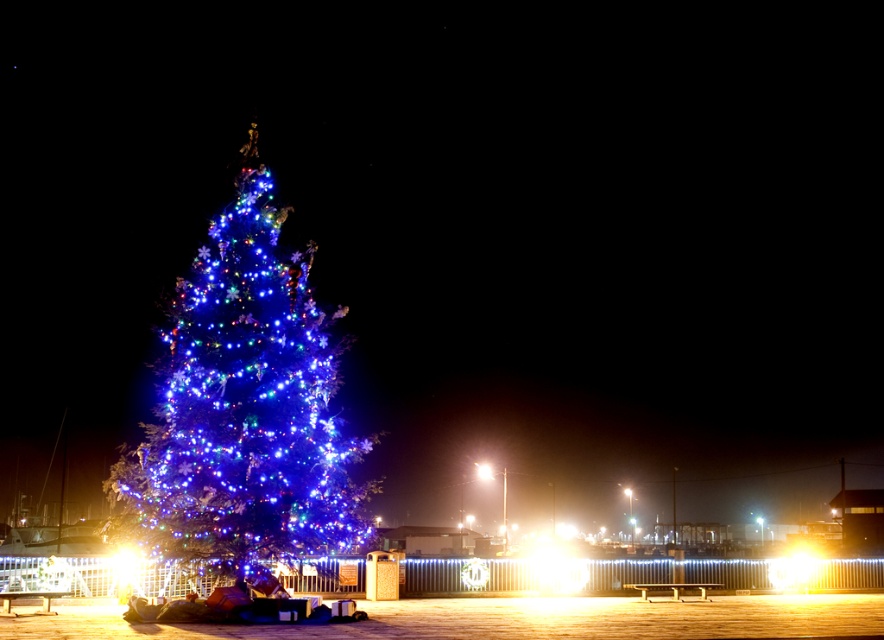
Question: Which point is farther to the camera?

Choices:
 (A) bright white light at center
 (B) illuminated blue lights at center

Answer: (A)

Question: Can you confirm if illuminated blue lights at center is positioned above bright white light at center?

Choices:
 (A) no
 (B) yes

Answer: (B)

Question: Which point is closer to the camera?

Choices:
 (A) (311, 349)
 (B) (492, 472)

Answer: (A)

Question: Is illuminated blue lights at center to the right of bright white light at center from the viewer's perspective?

Choices:
 (A) yes
 (B) no

Answer: (B)

Question: Which point is closer to the camera?

Choices:
 (A) bright white light at center
 (B) illuminated blue lights at center

Answer: (B)

Question: Can you confirm if illuminated blue lights at center is positioned above bright white light at center?

Choices:
 (A) no
 (B) yes

Answer: (B)